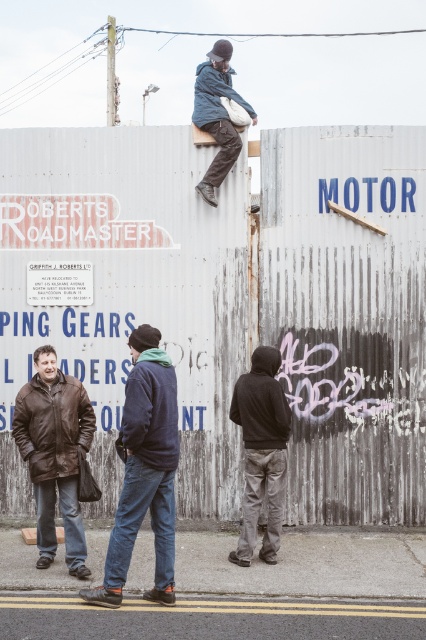
Question: Among these points, which one is farthest from the camera?

Choices:
 (A) (120, 444)
 (B) (265, 563)
 (C) (55, 420)
 (D) (249, 106)

Answer: (D)

Question: Does brown leather jacket at lower left lie behind dark gray hoodie at center?

Choices:
 (A) no
 (B) yes

Answer: (A)

Question: Can you confirm if brown leather jacket at lower left is positioned above dark gray hoodie at center?

Choices:
 (A) yes
 (B) no

Answer: (B)

Question: Which point is closer to the camera?

Choices:
 (A) dark blue jacket at center
 (B) denim jacket at upper center

Answer: (A)

Question: Can you confirm if dark blue jacket at center is positioned below denim jacket at upper center?

Choices:
 (A) no
 (B) yes

Answer: (B)

Question: Which of the following is the farthest from the observer?

Choices:
 (A) brown leather jacket at lower left
 (B) dark gray hoodie at center
 (C) denim jacket at upper center

Answer: (C)